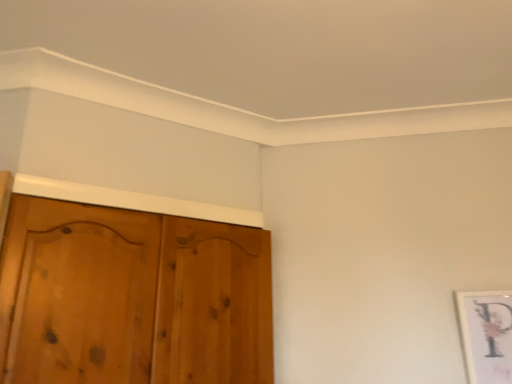
Where is `white matte picture frame at right`? The height and width of the screenshot is (384, 512). white matte picture frame at right is located at coordinates [486, 335].

Measure the distance between white matte picture frame at right and camera.

white matte picture frame at right is 4.57 feet from camera.

This screenshot has height=384, width=512. Describe the element at coordinates (486, 335) in the screenshot. I see `white matte picture frame at right` at that location.

Find the location of a particular element. This screenshot has height=384, width=512. white matte picture frame at right is located at coordinates (486, 335).